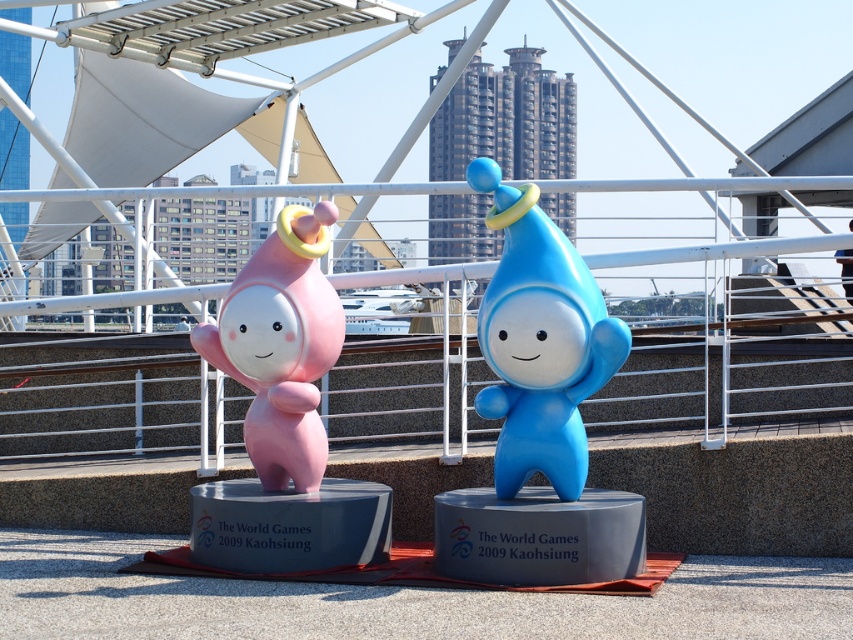
Is the position of blue glossy toy at center more distant than that of matte pink figure at left?

That is False.

This screenshot has width=853, height=640. What do you see at coordinates (540, 340) in the screenshot?
I see `blue glossy toy at center` at bounding box center [540, 340].

The image size is (853, 640). I want to click on blue glossy toy at center, so [x=540, y=340].